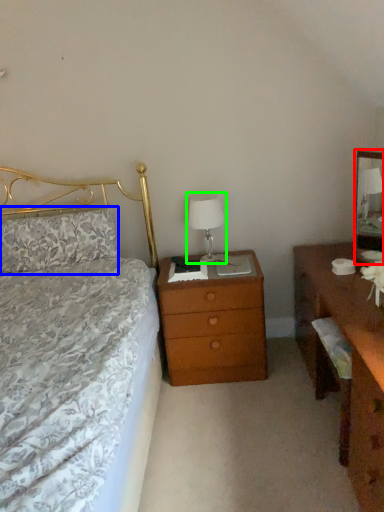
Question: Estimate the real-world distances between objects in this image. Which object is farther from mirror (highlighted by a red box), pillow (highlighted by a blue box) or bedside lamp (highlighted by a green box)?

Choices:
 (A) pillow
 (B) bedside lamp

Answer: (A)